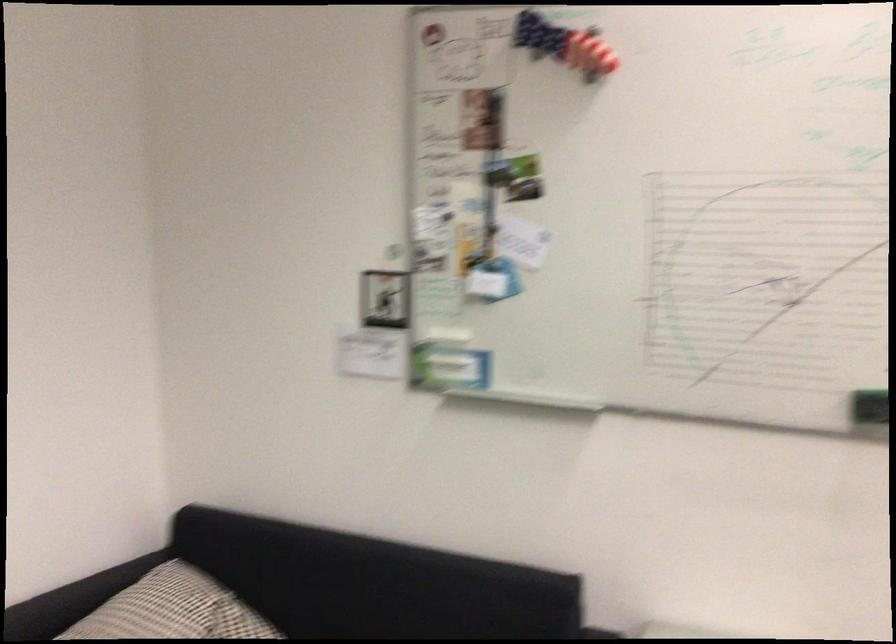
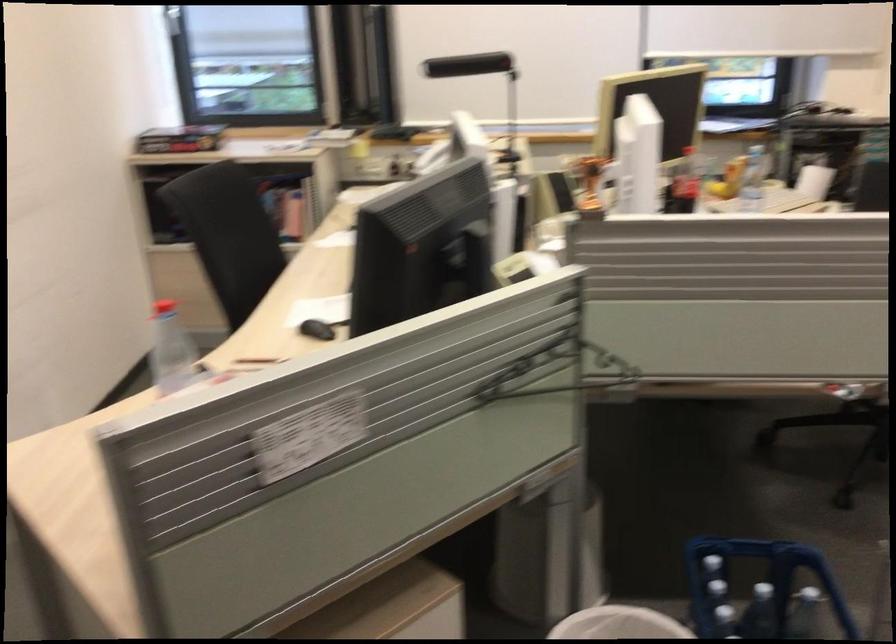
The images are taken continuously from a first-person perspective. In which direction is your viewpoint rotating?

The rotation direction of the camera is right-down.